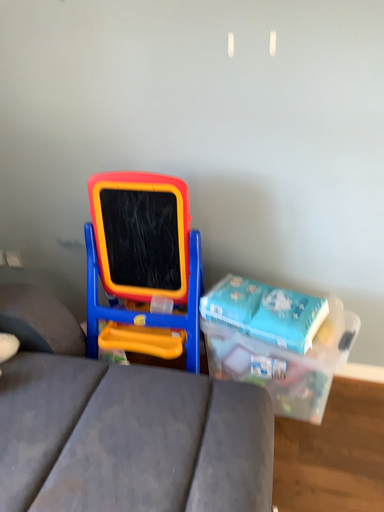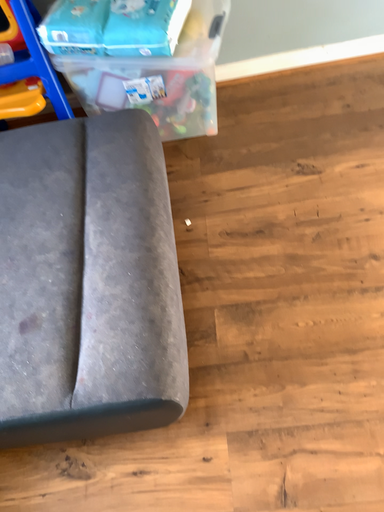
Question: How did the camera likely rotate when shooting the video?

Choices:
 (A) rotated left
 (B) rotated right

Answer: (B)